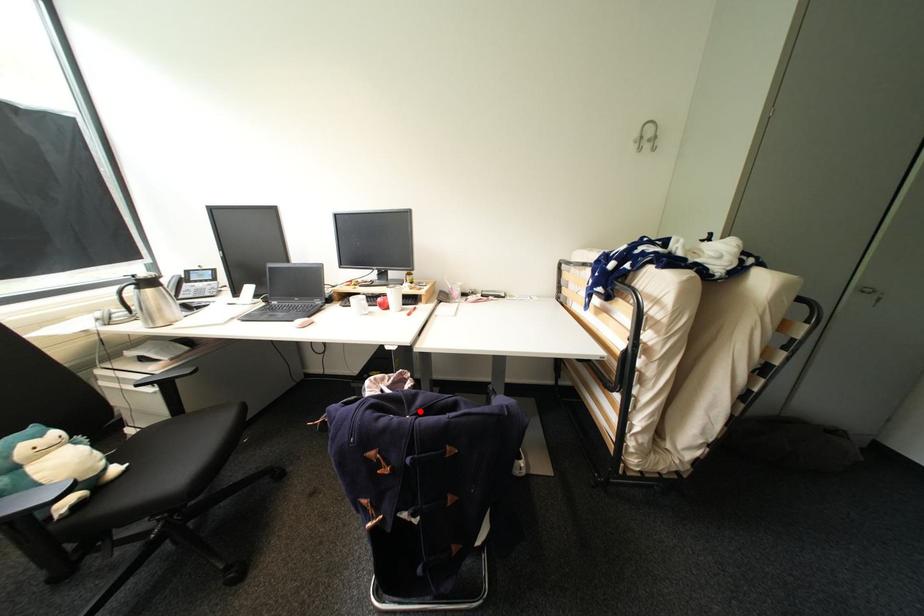
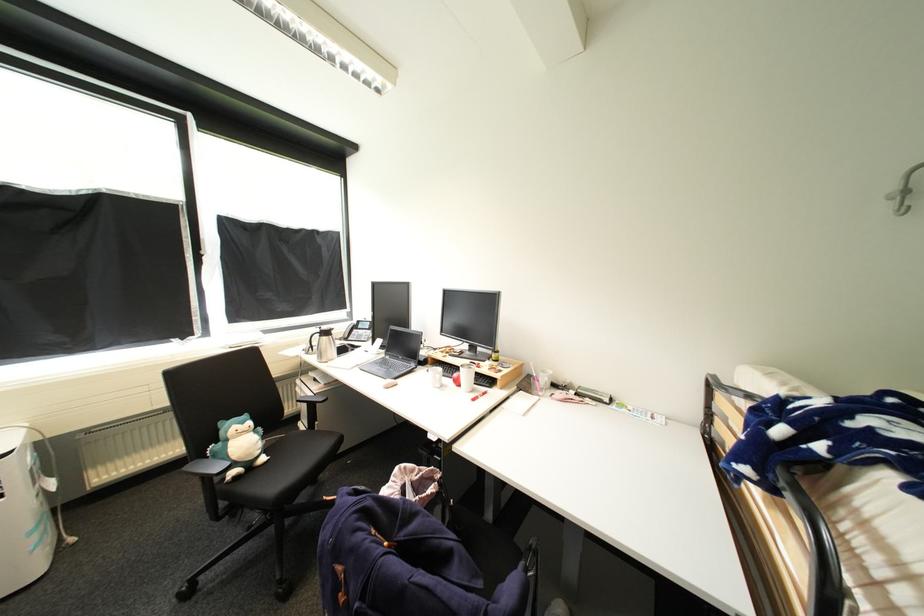
Question: I am providing you with two images of the same scene from different viewpoints. A red point is shown in image1. For the corresponding object point in image2, is it positioned nearer or farther from the camera?

Choices:
 (A) Nearer
 (B) Farther

Answer: (B)